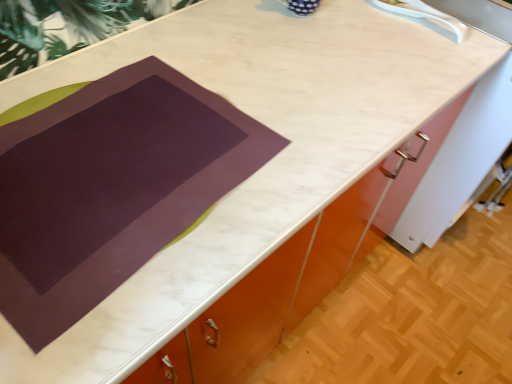
I want to click on vacant area that is in front of white plastic sink at upper right, so click(x=417, y=56).